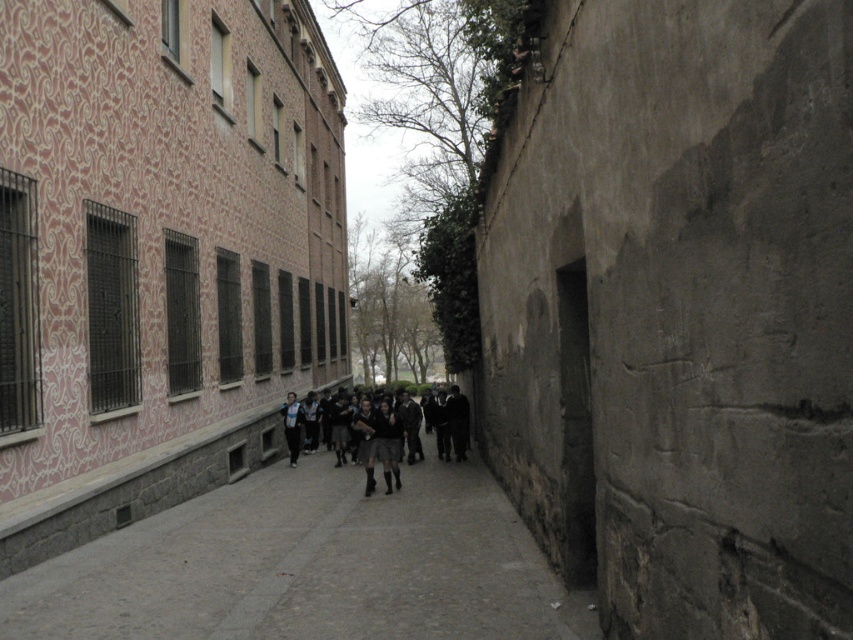
Can you confirm if gray concrete pavement at center is taller than dark gray uniform at center?

Indeed, gray concrete pavement at center has a greater height compared to dark gray uniform at center.

Between point (224, 611) and point (364, 461), which one is positioned behind?

Point (364, 461)

Where is `gray concrete pavement at center`? gray concrete pavement at center is located at coordinates (306, 566).